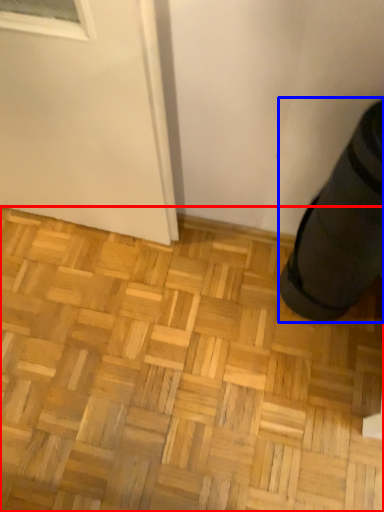
Question: Which object is closer to the camera taking this photo, hardwood (highlighted by a red box) or shoe (highlighted by a blue box)?

Choices:
 (A) hardwood
 (B) shoe

Answer: (B)